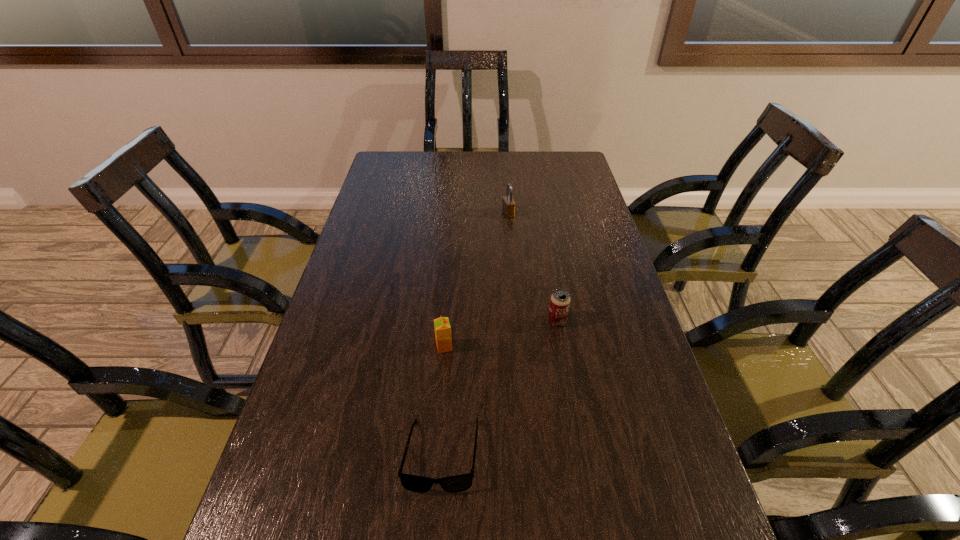
The height and width of the screenshot is (540, 960). In order to click on padlock in this screenshot , I will do `click(508, 204)`.

This screenshot has width=960, height=540. I want to click on the farthest object, so click(x=508, y=204).

You are a GUI agent. You are given a task and a screenshot of the screen. Output one action in this format:
    pyautogui.click(x=<x>, y=<y>)
    Task: Click on the third farthest object
    Image resolution: width=960 pixels, height=540 pixels.
    Given the screenshot: What is the action you would take?
    pyautogui.click(x=442, y=327)

This screenshot has width=960, height=540. I want to click on beer can, so click(559, 306).

Where is `the rightmost object`? Image resolution: width=960 pixels, height=540 pixels. the rightmost object is located at coordinates (559, 306).

Locate an element on the screen. This screenshot has height=540, width=960. the nearest object is located at coordinates (453, 484).

This screenshot has height=540, width=960. In order to click on the shortest object in this screenshot , I will do `click(453, 484)`.

Locate an element on the screen. vacant space located 0.320m on the left of the farthest object is located at coordinates (408, 214).

Find the location of a particular element. This screenshot has height=540, width=960. vacant area located 0.050m on the left of the orange juice is located at coordinates (415, 347).

Locate an element on the screen. Image resolution: width=960 pixels, height=540 pixels. vacant space located on the left of the rightmost object is located at coordinates (462, 321).